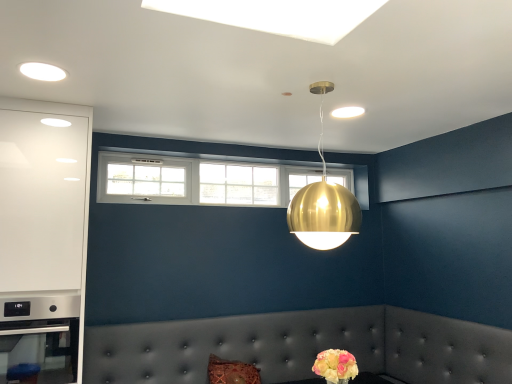
Question: Does tufted leather couch at lower center appear on the left side of gold metallic sphere at upper center?

Choices:
 (A) yes
 (B) no

Answer: (A)

Question: Is tufted leather couch at lower center located outside gold metallic sphere at upper center?

Choices:
 (A) no
 (B) yes

Answer: (B)

Question: Can you confirm if tufted leather couch at lower center is positioned to the right of gold metallic sphere at upper center?

Choices:
 (A) no
 (B) yes

Answer: (A)

Question: From a real-world perspective, is tufted leather couch at lower center physically below gold metallic sphere at upper center?

Choices:
 (A) no
 (B) yes

Answer: (B)

Question: Does tufted leather couch at lower center have a lesser height compared to gold metallic sphere at upper center?

Choices:
 (A) no
 (B) yes

Answer: (B)

Question: From a real-world perspective, is white glossy cabinet at left positioned above or below white glass window at upper center?

Choices:
 (A) above
 (B) below

Answer: (B)

Question: Based on their sizes in the image, would you say white glossy cabinet at left is bigger or smaller than white glass window at upper center?

Choices:
 (A) big
 (B) small

Answer: (A)

Question: Considering the positions of white glossy cabinet at left and white glass window at upper center in the image, is white glossy cabinet at left taller or shorter than white glass window at upper center?

Choices:
 (A) tall
 (B) short

Answer: (A)

Question: Looking at their shapes, would you say white glossy cabinet at left is wider or thinner than white glass window at upper center?

Choices:
 (A) thin
 (B) wide

Answer: (B)

Question: In the image, is white glossy cabinet at left positioned in front of or behind pastel yellow bouquet at lower right?

Choices:
 (A) front
 (B) behind

Answer: (B)

Question: Is point (42, 132) closer or farther from the camera than point (331, 377)?

Choices:
 (A) farther
 (B) closer

Answer: (A)

Question: From the image's perspective, is white glossy cabinet at left positioned above or below pastel yellow bouquet at lower right?

Choices:
 (A) above
 (B) below

Answer: (A)

Question: Is white glossy cabinet at left wider or thinner than pastel yellow bouquet at lower right?

Choices:
 (A) wide
 (B) thin

Answer: (A)

Question: Is pastel yellow bouquet at lower right inside the boundaries of gold metallic sphere at upper center, or outside?

Choices:
 (A) inside
 (B) outside

Answer: (B)

Question: Is point (338, 350) positioned closer to the camera than point (323, 92)?

Choices:
 (A) closer
 (B) farther

Answer: (A)